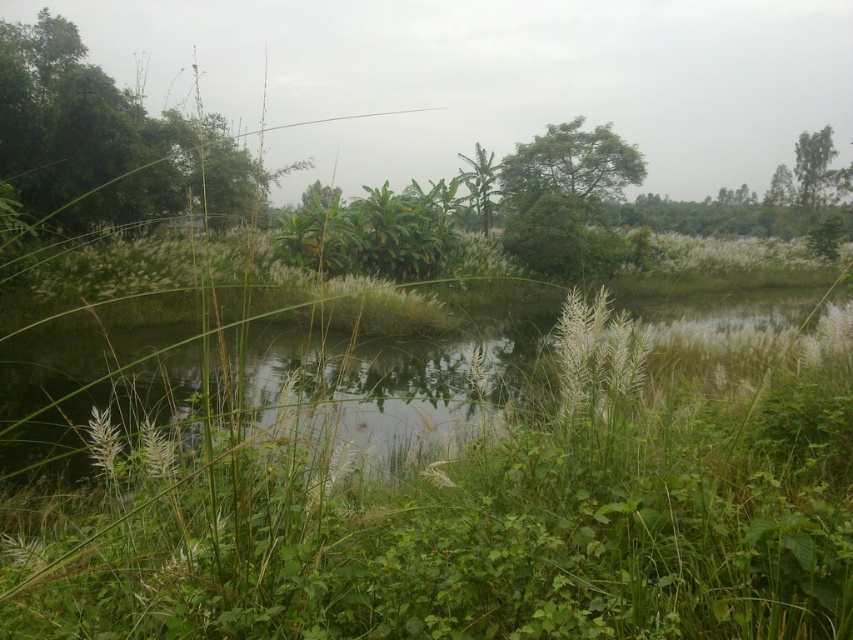
Question: Does green leafy tree at left come behind green leafy tree at center?

Choices:
 (A) no
 (B) yes

Answer: (A)

Question: Which of these objects is positioned closest to the green leafy tree at left?

Choices:
 (A) green leafy plant at center
 (B) green leafy tree at upper right

Answer: (A)

Question: Among these objects, which one is farthest from the camera?

Choices:
 (A) green leafy tree at upper right
 (B) green leafy tree at center

Answer: (A)

Question: Which of these objects is positioned farthest from the green leafy tree at left?

Choices:
 (A) green leafy tree at center
 (B) green leafy tree at upper right
 (C) green leafy plant at center

Answer: (B)

Question: Is green leafy tree at center positioned at the back of green leafy tree at upper right?

Choices:
 (A) no
 (B) yes

Answer: (A)

Question: Can you confirm if green leafy tree at left is positioned to the left of green leafy tree at upper right?

Choices:
 (A) no
 (B) yes

Answer: (B)